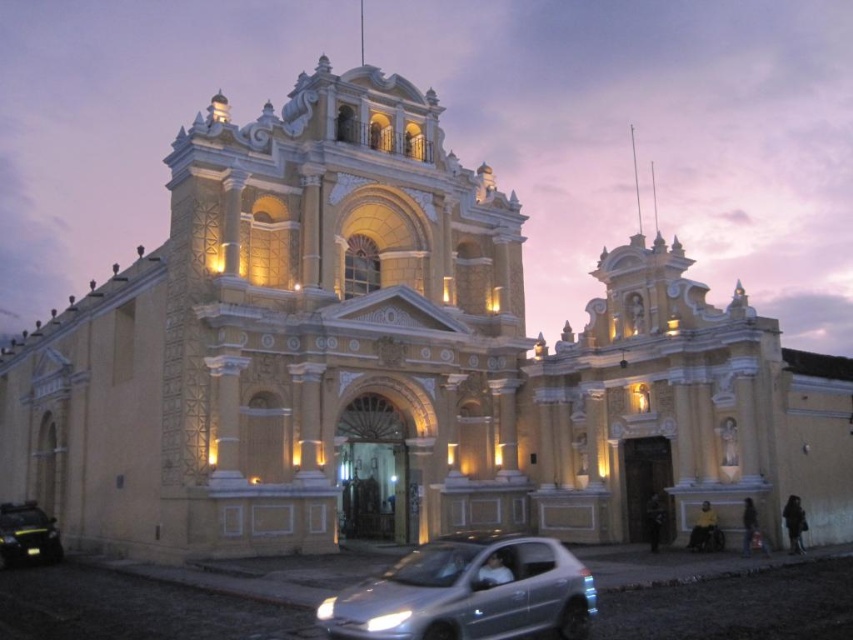
You are driving a car and need to park it in the parking lot near the grand, ornate building. The parking spot is marked at point (468, 593). Can you safely park your car there without blocking the entrance?

The parking spot at point (468, 593) is occupied by a silver metallic car at lower center, so you cannot park there without moving the existing car.

You are a photographer standing in front of the grand building at dusk. You want to capture a photo that includes both the silver metallic car at lower center and the metallic silver car at lower left. Which car should you adjust your camera angle to focus on first to ensure both are in frame?

The silver metallic car at lower center is above the metallic silver car at lower left, so adjusting the camera angle to focus on the silver metallic car at lower center first will help ensure both cars are captured in the frame.

You are a delivery driver who needs to park your car between the silver metallic car at lower center and the metallic silver car at lower left. The parking spot between them can accommodate a car that is 2.5 meters long. Is there enough space for your car?

The distance between the silver metallic car at lower center and the metallic silver car at lower left is 30.29 meters, which is more than enough to accommodate a car that is 2.5 meters long. You can safely park your car there.